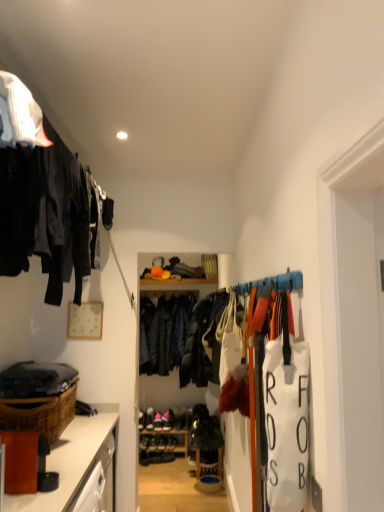
Question: From the image's perspective, is wooden shelf at center located above or below brown woven basket at lower left?

Choices:
 (A) below
 (B) above

Answer: (A)

Question: Is wooden shelf at center in front of or behind brown woven basket at lower left in the image?

Choices:
 (A) front
 (B) behind

Answer: (B)

Question: Considering the real-world distances, which object is closest to the wooden shelf at center?

Choices:
 (A) dark blue leather jacket at center
 (B) brown wood cabinet at lower left
 (C) brown woven basket at lower left
 (D) matte black clothing at upper left
 (E) pink suede shoes at center

Answer: (E)

Question: Based on their relative distances, which object is nearer to the brown wood cabinet at lower left?

Choices:
 (A) pink suede shoes at center
 (B) dark blue leather jacket at center
 (C) matte black clothing at upper left
 (D) wooden shelf at center
 (E) brown woven basket at lower left

Answer: (E)